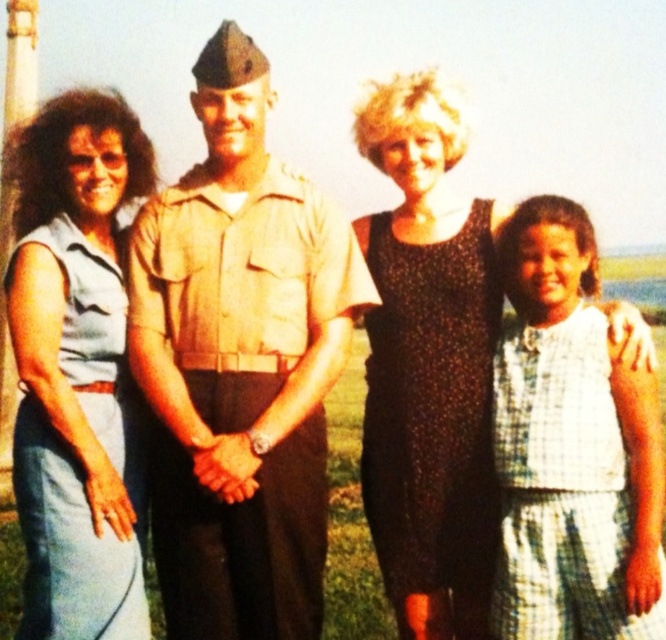
Question: Is black dotted dress at center below blue denim dress at left?

Choices:
 (A) no
 (B) yes

Answer: (A)

Question: Which object is closer to the camera taking this photo?

Choices:
 (A) khaki uniform at center
 (B) white checkered dress at right
 (C) blue denim dress at left

Answer: (B)

Question: Is khaki uniform at center to the right of black dotted dress at center from the viewer's perspective?

Choices:
 (A) yes
 (B) no

Answer: (B)

Question: Estimate the real-world distances between objects in this image. Which object is farther from the white checkered dress at right?

Choices:
 (A) khaki uniform at center
 (B) blue denim dress at left
 (C) black dotted dress at center

Answer: (B)

Question: Does blue denim dress at left appear over white checkered dress at right?

Choices:
 (A) yes
 (B) no

Answer: (A)

Question: Which of the following is the closest to the observer?

Choices:
 (A) (109, 548)
 (B) (434, 481)
 (C) (220, 257)

Answer: (A)